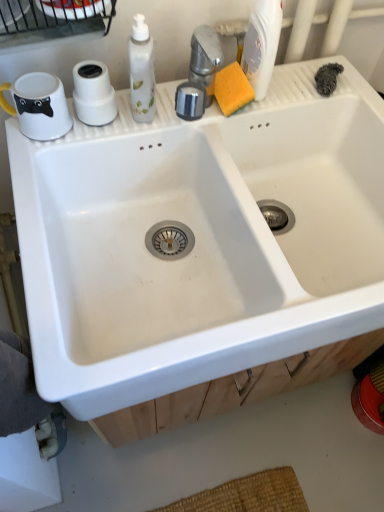
Question: Can you confirm if wooden drawer at lower center is positioned to the right of white matte toilet paper at upper left?

Choices:
 (A) no
 (B) yes

Answer: (B)

Question: Does wooden drawer at lower center have a greater height compared to white matte toilet paper at upper left?

Choices:
 (A) no
 (B) yes

Answer: (A)

Question: Is wooden drawer at lower center smaller than white matte toilet paper at upper left?

Choices:
 (A) yes
 (B) no

Answer: (B)

Question: From the image's perspective, is wooden drawer at lower center below white matte toilet paper at upper left?

Choices:
 (A) no
 (B) yes

Answer: (B)

Question: Does wooden drawer at lower center have a larger size compared to white matte toilet paper at upper left?

Choices:
 (A) no
 (B) yes

Answer: (B)

Question: Is wooden drawer at lower center aimed at white matte toilet paper at upper left?

Choices:
 (A) no
 (B) yes

Answer: (A)

Question: Can wooden drawer at lower center be found inside white matte toilet paper at upper left?

Choices:
 (A) yes
 (B) no

Answer: (B)

Question: From the image's perspective, is white matte toilet paper at upper left under wooden drawer at lower center?

Choices:
 (A) no
 (B) yes

Answer: (A)

Question: Is white matte toilet paper at upper left touching wooden drawer at lower center?

Choices:
 (A) yes
 (B) no

Answer: (B)

Question: Is white matte toilet paper at upper left not close to wooden drawer at lower center?

Choices:
 (A) no
 (B) yes

Answer: (A)

Question: Does white matte toilet paper at upper left have a lesser height compared to wooden drawer at lower center?

Choices:
 (A) yes
 (B) no

Answer: (B)

Question: Considering the relative sizes of white matte toilet paper at upper left and wooden drawer at lower center in the image provided, is white matte toilet paper at upper left thinner than wooden drawer at lower center?

Choices:
 (A) yes
 (B) no

Answer: (A)

Question: Is the position of white matte toilet paper at upper left more distant than that of white plastic bottle at upper right?

Choices:
 (A) no
 (B) yes

Answer: (B)